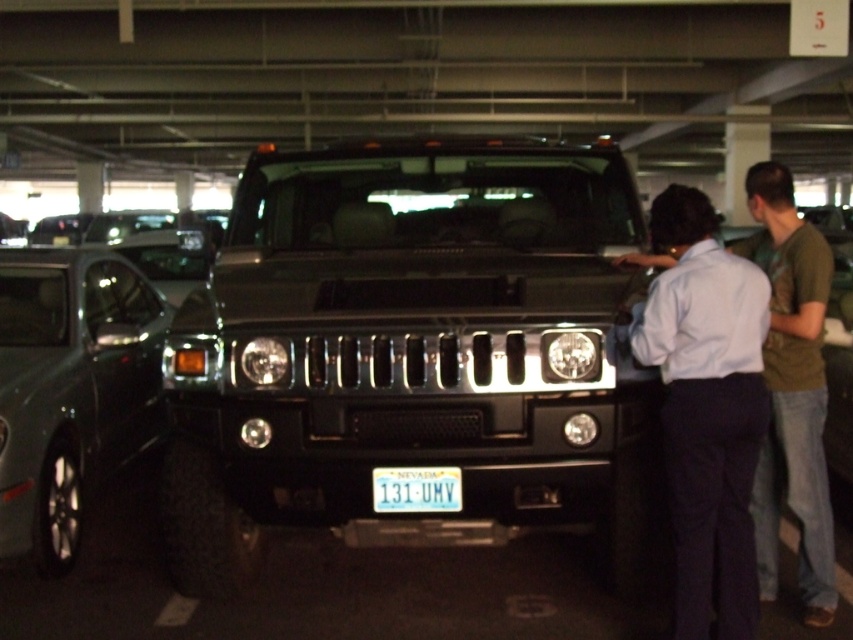
Does shiny black suv at center come behind green cotton shirt at right?

That is True.

In the scene shown: Who is positioned more to the right, shiny black suv at center or green cotton shirt at right?

green cotton shirt at right

What do you see at coordinates (409, 355) in the screenshot? This screenshot has height=640, width=853. I see `shiny black suv at center` at bounding box center [409, 355].

The image size is (853, 640). Identify the location of shiny black suv at center. (409, 355).

Which is behind, point (457, 188) or point (61, 392)?

Positioned behind is point (457, 188).

Which of these two, shiny black suv at center or satin silver car at left, stands taller?

Standing taller between the two is shiny black suv at center.

Locate an element on the screen. shiny black suv at center is located at coordinates (409, 355).

Is green cotton shirt at right behind blue metallic license plate at center?

No.

This screenshot has height=640, width=853. Describe the element at coordinates (792, 390) in the screenshot. I see `green cotton shirt at right` at that location.

Find the location of a particular element. The height and width of the screenshot is (640, 853). green cotton shirt at right is located at coordinates (792, 390).